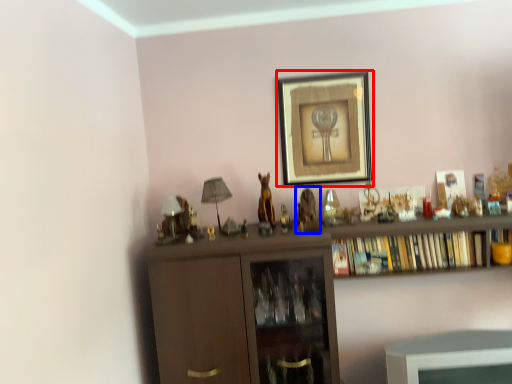
Question: Which object appears closest to the camera in this image, picture frame (highlighted by a red box) or animal (highlighted by a blue box)?

Choices:
 (A) picture frame
 (B) animal

Answer: (B)